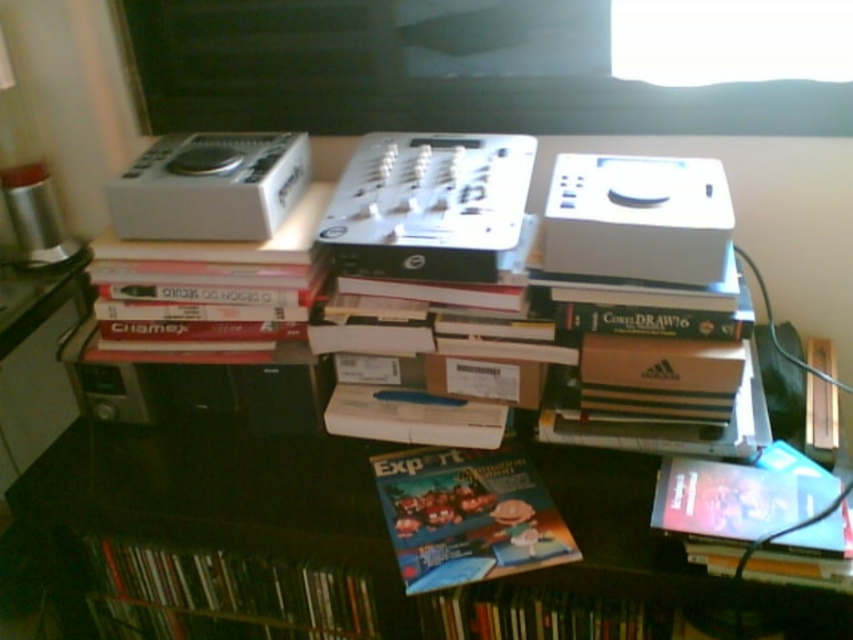
Question: Which of the following is the closest to the observer?

Choices:
 (A) matte plastic book at lower right
 (B) matte plastic book at lower left
 (C) matte black magazine at center
 (D) matte paper magazine at center

Answer: (A)

Question: Is matte plastic book at lower left bigger than matte plastic book at lower right?

Choices:
 (A) yes
 (B) no

Answer: (A)

Question: From the image, what is the correct spatial relationship of matte black magazine at center in relation to matte plastic book at lower right?

Choices:
 (A) below
 (B) above

Answer: (A)

Question: Which point is farther to the camera?

Choices:
 (A) matte plastic book at lower right
 (B) matte paper magazine at center
 (C) matte black magazine at center
 (D) matte plastic book at lower left

Answer: (D)

Question: Which point is farther from the camera taking this photo?

Choices:
 (A) (717, 534)
 (B) (212, 586)
 (C) (401, 460)
 (D) (183, 456)

Answer: (B)

Question: Can you confirm if matte paper magazine at center is positioned below matte plastic book at lower right?

Choices:
 (A) no
 (B) yes

Answer: (B)